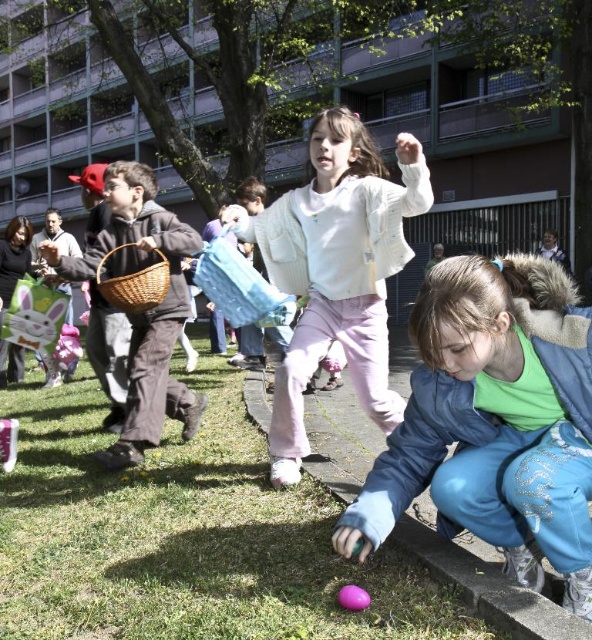
Based on the photo, you are a parent trying to locate your child who is wearing a white fuzzy sweater at center. The child is currently holding a matte brown wicker basket at left. Can you estimate how far apart they are?

The distance between the white fuzzy sweater at center and the matte brown wicker basket at left is 35.19 inches, so they are approximately 35 inches apart.

Consider the image. You are a photographer standing in the grassy area. You want to take a photo of the white fuzzy sweater at center without the green grass at lower left blocking the view. Is it possible?

The green grass at lower left is in front of the white fuzzy sweater at center, so it will block the view. Move to a position where the white fuzzy sweater at center is between you and the green grass at lower left to avoid obstruction.

You are a parent watching your children play in the Easter egg hunt. You notice the white fuzzy sweater at center and the green grass at lower left. Which object is taller?

The white fuzzy sweater at center is taller than the green grass at lower left.